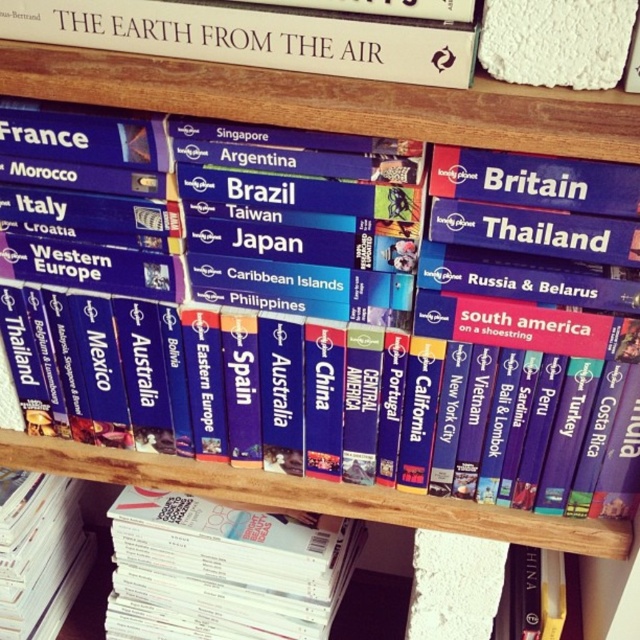
Question: Based on their relative distances, which object is nearer to the white glossy book at lower center?

Choices:
 (A) white paper book at upper center
 (B) white paper book at lower left

Answer: (B)

Question: Is white glossy book at lower center thinner than white paper book at upper center?

Choices:
 (A) no
 (B) yes

Answer: (B)

Question: Can you confirm if white glossy book at lower center is wider than white paper book at upper center?

Choices:
 (A) yes
 (B) no

Answer: (B)

Question: Which point is farther to the camera?

Choices:
 (A) (385, 17)
 (B) (128, 620)

Answer: (B)

Question: Is white glossy book at lower center bigger than white paper book at lower left?

Choices:
 (A) yes
 (B) no

Answer: (A)

Question: Among these objects, which one is farthest from the camera?

Choices:
 (A) white paper book at upper center
 (B) white glossy book at lower center

Answer: (B)